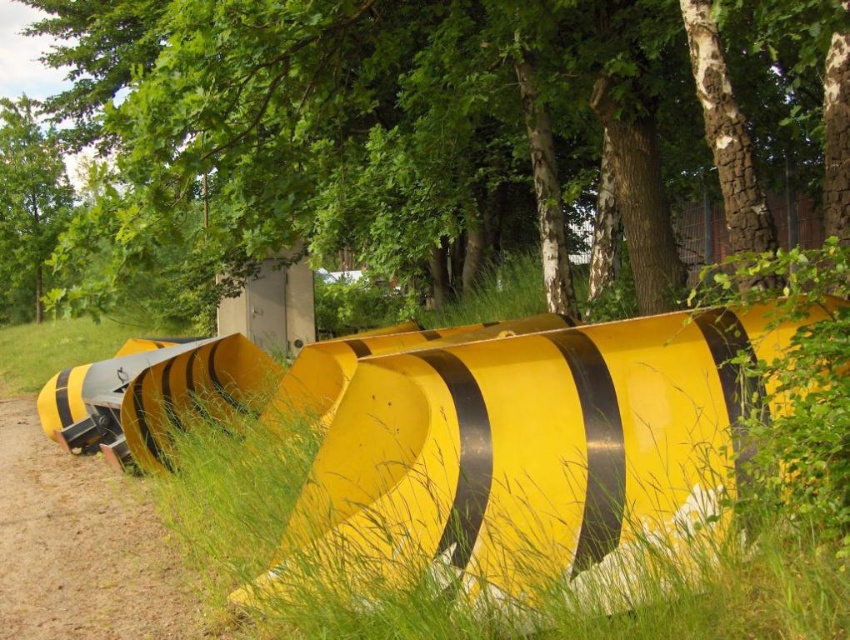
Does brown textured tree at upper center appear on the left side of yellow matte dirt track at lower left?

Correct, you'll find brown textured tree at upper center to the left of yellow matte dirt track at lower left.

Between point (622, 90) and point (61, 513), which one is positioned in front?

Point (61, 513) is in front.

The image size is (850, 640). In order to click on brown textured tree at upper center in this screenshot , I will do `click(417, 138)`.

Between yellow matte dirt track at lower left and green leafy tree at upper left, which one has more height?

green leafy tree at upper left

Is point (179, 621) in front of point (29, 243)?

Yes.

Identify the location of yellow matte dirt track at lower left. This screenshot has width=850, height=640. (82, 547).

At what (x,y) coordinates should I click in order to perform the action: click on brown textured tree at upper center. Please return your answer as a coordinate pair (x, y). Image resolution: width=850 pixels, height=640 pixels. Looking at the image, I should click on (417, 138).

Can you confirm if brown textured tree at upper center is bigger than green leafy tree at upper left?

Yes, brown textured tree at upper center is bigger than green leafy tree at upper left.

Locate an element on the screen. brown textured tree at upper center is located at coordinates (417, 138).